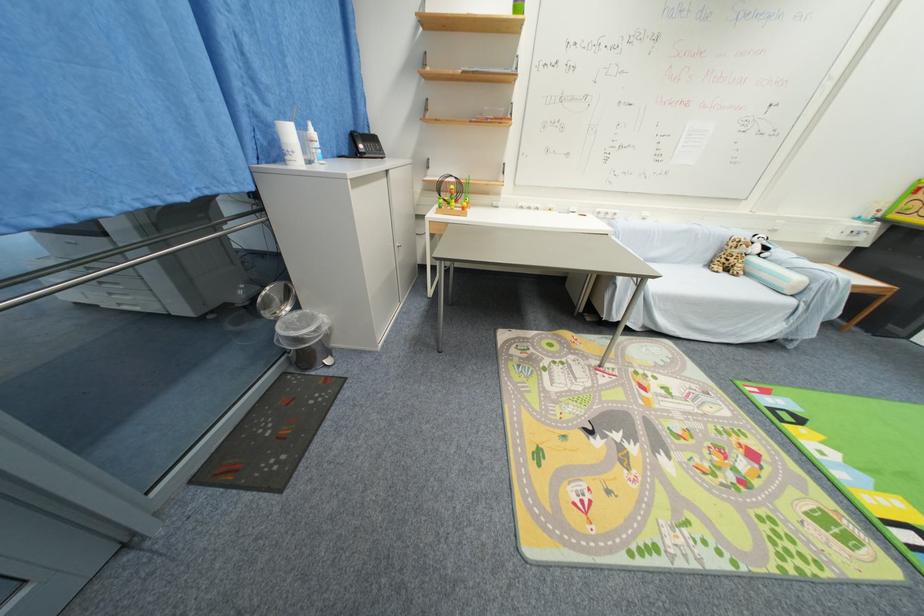
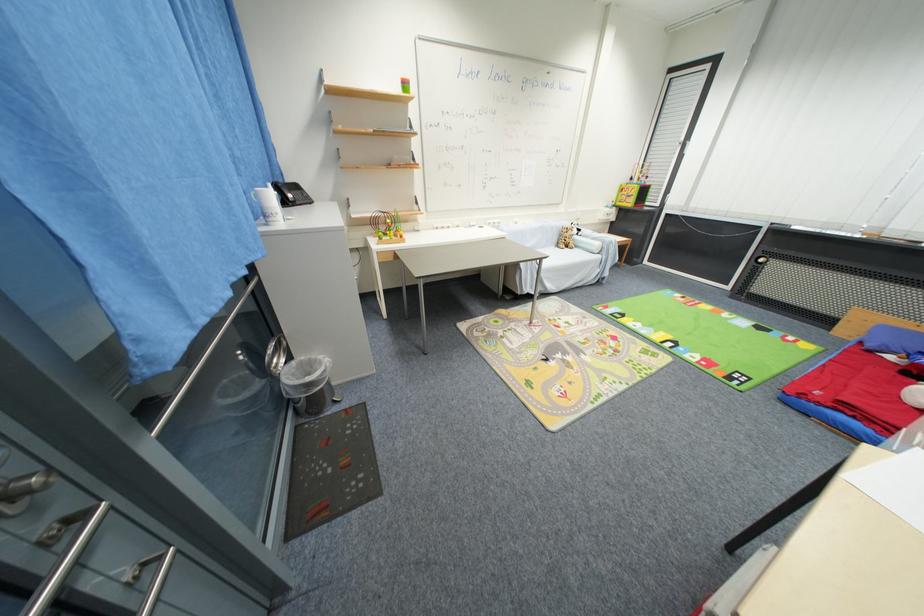
Where in the second image is the point corresponding to pixel 301 309 from the first image?

(295, 360)